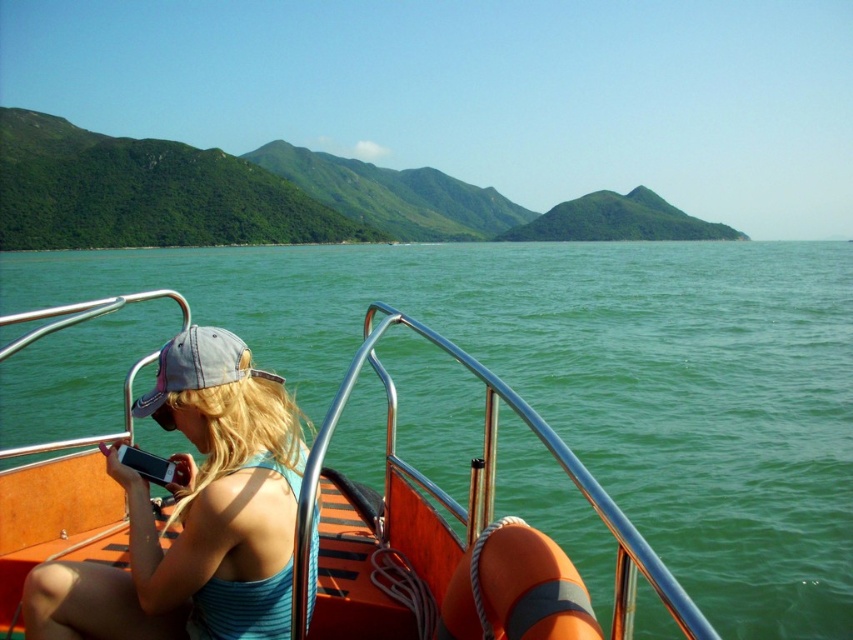
Is orange wood boat at center to the left of blue striped tank top at center from the viewer's perspective?

Correct, you'll find orange wood boat at center to the left of blue striped tank top at center.

Who is more forward, (334, 400) or (274, 563)?

Point (334, 400) is more forward.

Is point (12, 605) in front of point (233, 520)?

No.

What are the coordinates of `orange wood boat at center` in the screenshot? It's located at (442, 522).